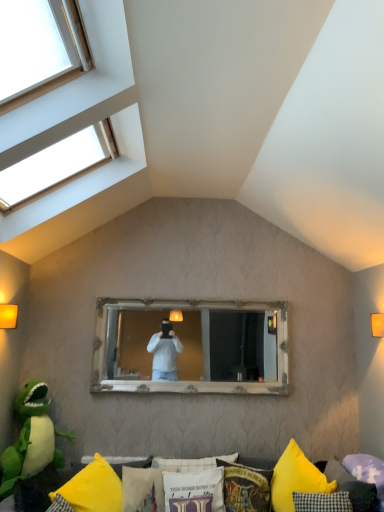
Question: From the image's perspective, would you say yellow fabric cushion at lower center is shown under white fabric pillow at lower center, the third pillow positioned from the left?

Choices:
 (A) yes
 (B) no

Answer: (A)

Question: Is yellow fabric cushion at lower center facing towards white fabric pillow at lower center, arranged as the third pillow when viewed from the right?

Choices:
 (A) yes
 (B) no

Answer: (A)

Question: Is yellow fabric cushion at lower center oriented away from white fabric pillow at lower center, the third pillow positioned from the left?

Choices:
 (A) no
 (B) yes

Answer: (B)

Question: From a real-world perspective, is yellow fabric cushion at lower center over white fabric pillow at lower center, the third pillow positioned from the left?

Choices:
 (A) no
 (B) yes

Answer: (A)

Question: Does yellow fabric cushion at lower center have a larger size compared to white fabric pillow at lower center, the third pillow positioned from the left?

Choices:
 (A) yes
 (B) no

Answer: (A)

Question: Would you say yellow fabric cushion at lower center contains white fabric pillow at lower center, the third pillow positioned from the left?

Choices:
 (A) no
 (B) yes

Answer: (B)

Question: Can you confirm if yellow fabric pillow at lower center, the first pillow viewed from the left, is bigger than purple fabric pillow at lower right, which ranks as the first pillow in right-to-left order?

Choices:
 (A) no
 (B) yes

Answer: (B)

Question: Is yellow fabric pillow at lower center, the first pillow viewed from the left, not inside purple fabric pillow at lower right, which is the 5th pillow from left to right?

Choices:
 (A) no
 (B) yes

Answer: (B)

Question: Can you confirm if yellow fabric pillow at lower center, the first pillow viewed from the left, is shorter than purple fabric pillow at lower right, which ranks as the first pillow in right-to-left order?

Choices:
 (A) no
 (B) yes

Answer: (A)

Question: Does yellow fabric pillow at lower center, the first pillow viewed from the left, lie in front of purple fabric pillow at lower right, which ranks as the first pillow in right-to-left order?

Choices:
 (A) no
 (B) yes

Answer: (B)

Question: From a real-world perspective, is yellow fabric pillow at lower center, the first pillow viewed from the left, on purple fabric pillow at lower right, which ranks as the first pillow in right-to-left order?

Choices:
 (A) no
 (B) yes

Answer: (A)

Question: Is yellow fabric pillow at lower center, the first pillow viewed from the left, not near purple fabric pillow at lower right, which ranks as the first pillow in right-to-left order?

Choices:
 (A) no
 (B) yes

Answer: (B)

Question: Is clear glass window at upper left taller than white fabric pillow at lower center, arranged as the third pillow when viewed from the right?

Choices:
 (A) no
 (B) yes

Answer: (B)